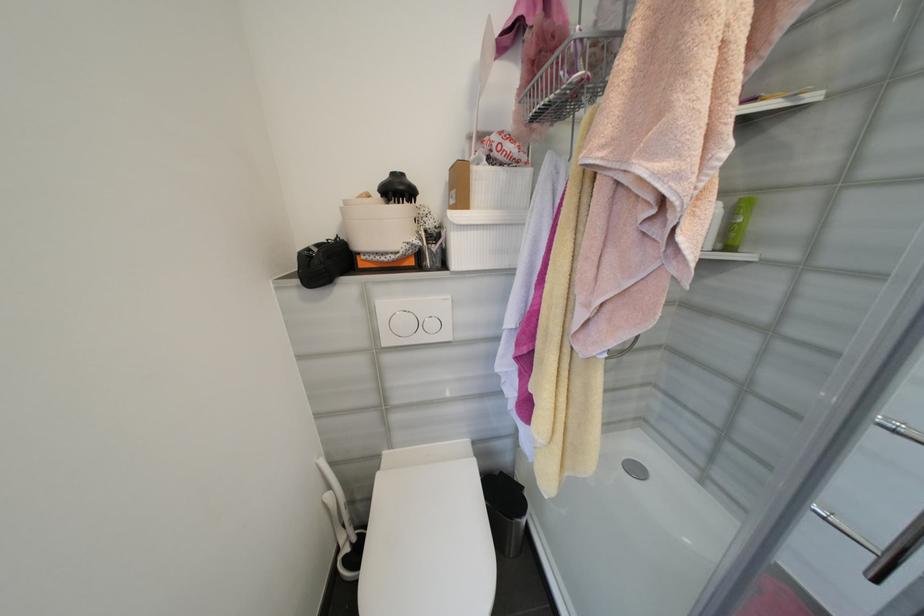
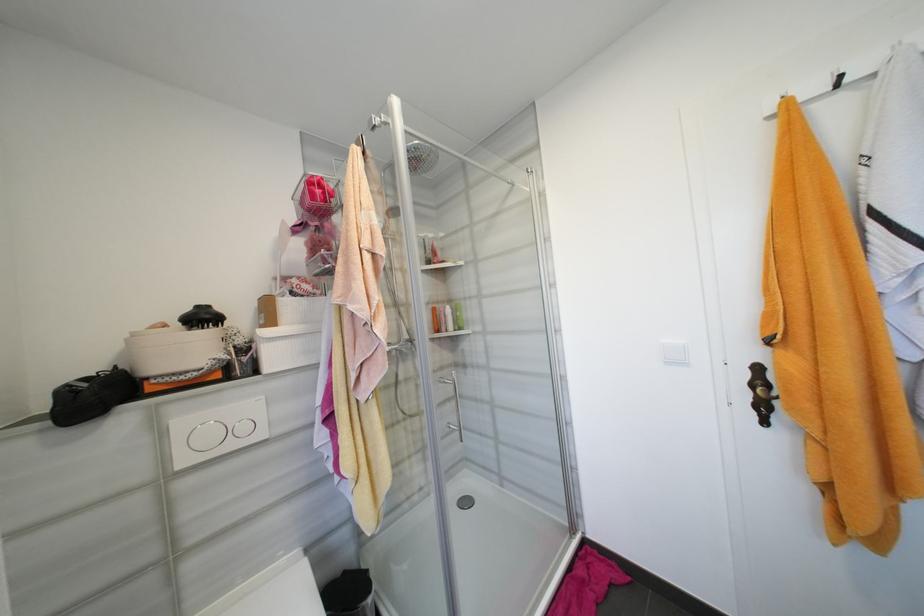
Locate, in the second image, the point that corresponds to (445,236) in the first image.

(256, 349)